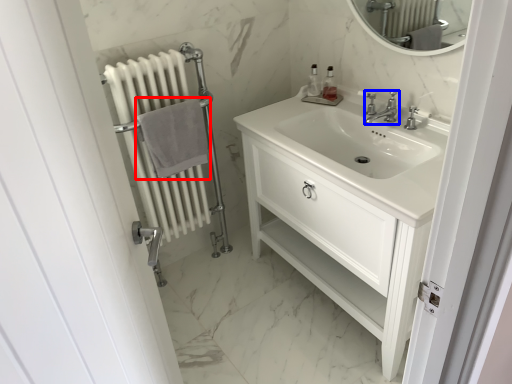
Question: Which point is closer to the camera, bath towel (highlighted by a red box) or tap (highlighted by a blue box)?

Choices:
 (A) bath towel
 (B) tap

Answer: (B)